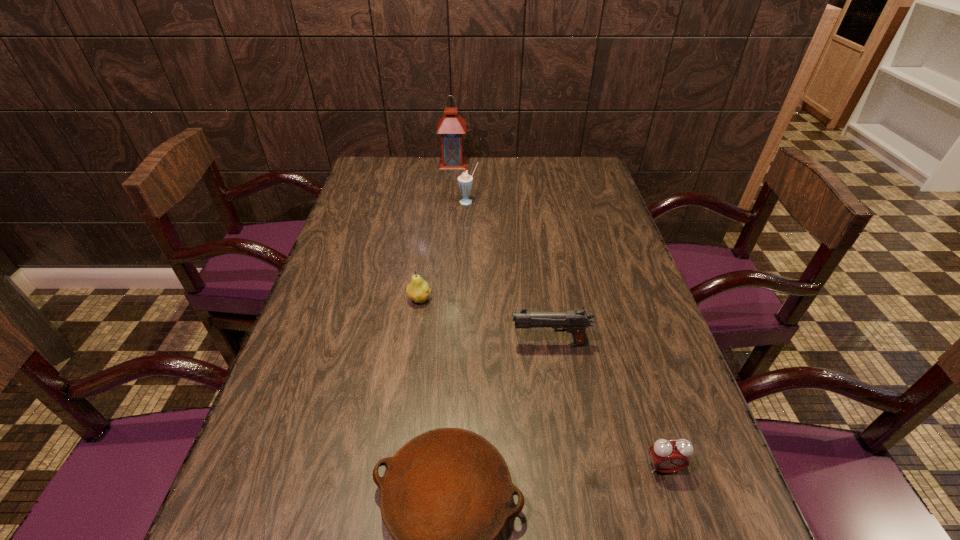
Find the location of a particular element. Image resolution: width=960 pixels, height=540 pixels. free spot at the far left corner of the desktop is located at coordinates (380, 172).

The width and height of the screenshot is (960, 540). In the image, there is a desktop. Find the location of `vacant space at the far right corner`. vacant space at the far right corner is located at coordinates (573, 186).

I want to click on blank region between the fourth farthest object and the third farthest object, so click(x=485, y=321).

At what (x,y) coordinates should I click in order to perform the action: click on vacant area between the tallest object and the gun. Please return your answer as a coordinate pair (x, y). This screenshot has height=540, width=960. Looking at the image, I should click on (501, 253).

Identify the location of object identified as the closest to the lantern. point(465,181).

Locate which object ranks fourth in proximity to the fifth shortest object. Please provide its 2D coordinates. Your answer should be formatted as a tuple, i.e. [(x, y)], where the tuple contains the x and y coordinates of a point satisfying the conditions above.

[(446, 494)]